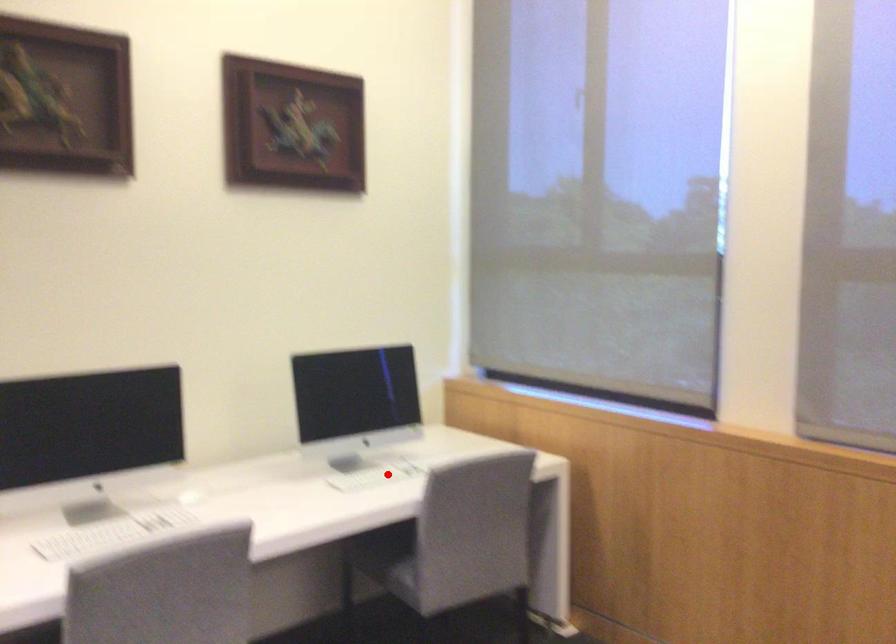
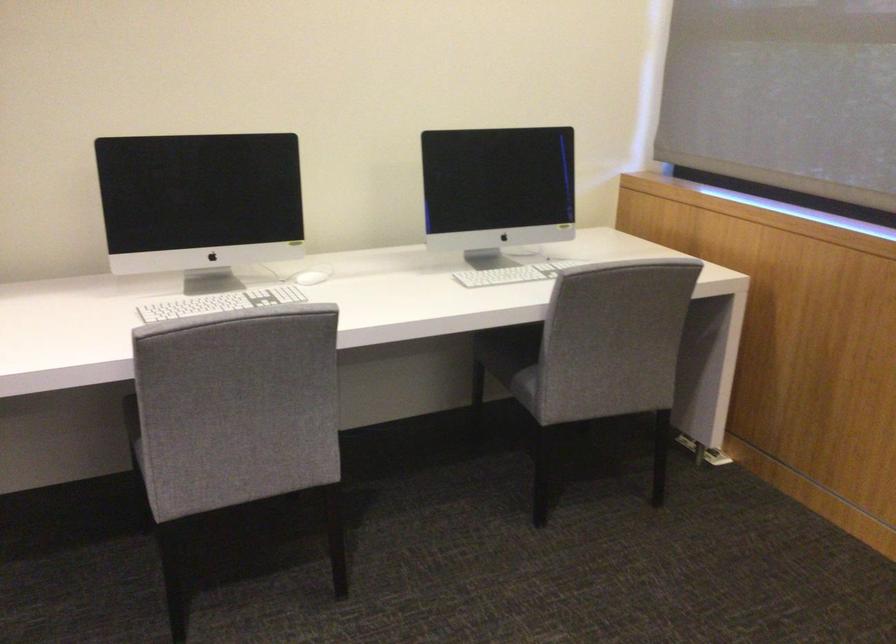
Question: I am providing you with two images of the same scene from different viewpoints. A red point is shown in image1. For the corresponding object point in image2, is it positioned nearer or farther from the camera?

Choices:
 (A) Nearer
 (B) Farther

Answer: (A)